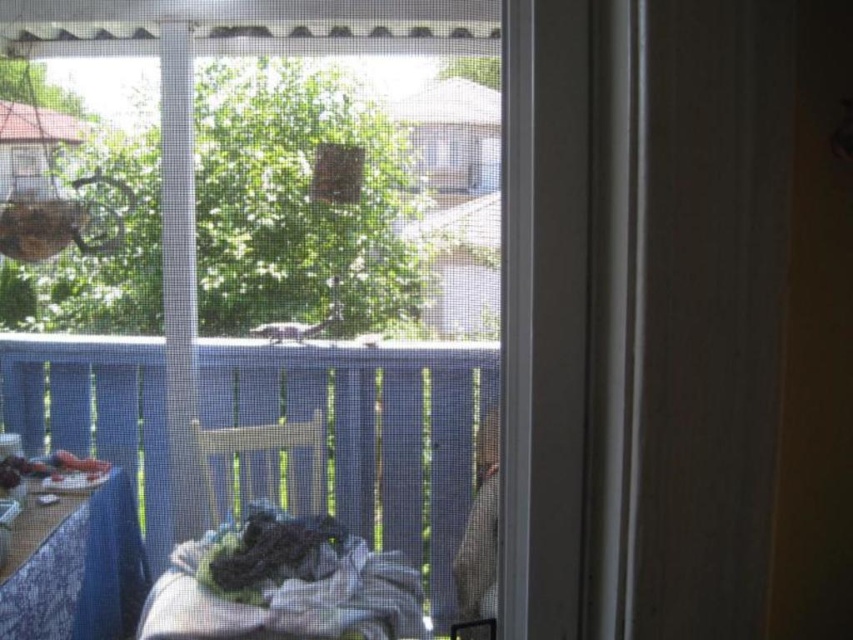
You are trying to determine if you can see the tree outside through the transparent plastic window at center without moving the wooden table at lower left. Based on their heights, is this possible?

The transparent plastic window at center has a greater height compared to the wooden table at lower left, so yes, you can see the tree outside through the transparent plastic window at center without moving the wooden table at lower left because the window is taller than the table.

You are trying to decide whether to place a large potted plant on the wooden table at lower left so it can be seen through the transparent plastic window at center. Based on their sizes, will the plant fit on the table and still be visible through the window?

The transparent plastic window at center is bigger than the wooden table at lower left, so the plant may fit on the table but the window is larger, meaning the plant could be positioned to be visible through the window as long as it is placed within the table area.